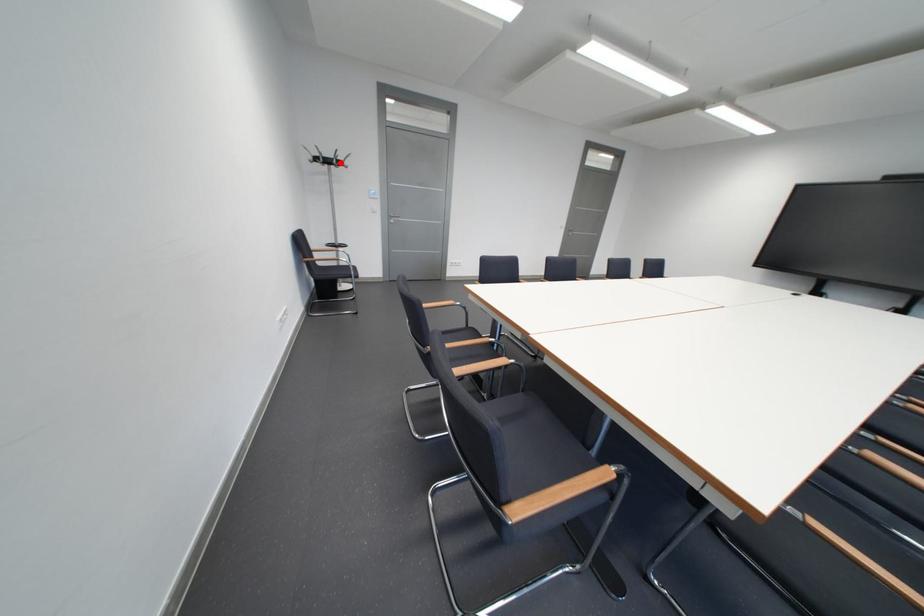
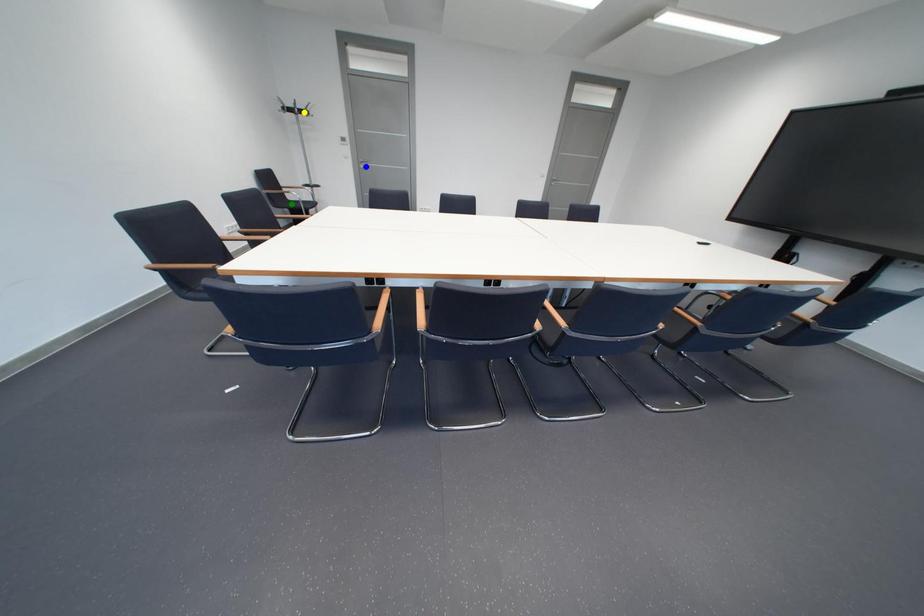
Question: I am providing you with two images of the same scene from different viewpoints. A red point is marked on the first image. You are given multiple points on the second image. In image 2, which mark is for the same physical point as the one in image 1?

Choices:
 (A) blue point
 (B) green point
 (C) yellow point

Answer: (C)